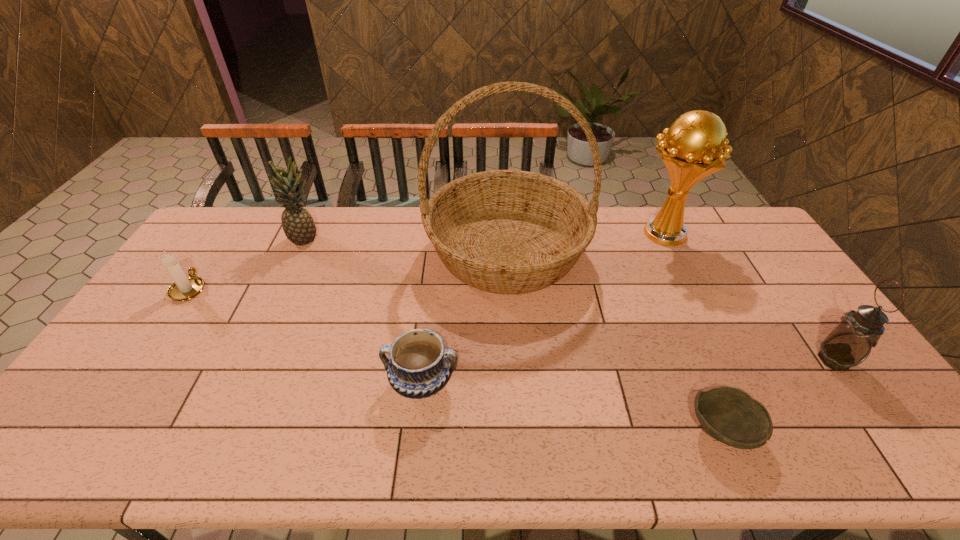
The width and height of the screenshot is (960, 540). What are the coordinates of `vacant area that lies between the candle holder and the second shortest object` in the screenshot? It's located at point(305,335).

Locate an element on the screen. empty location between the tallest object and the rightmost object is located at coordinates (670, 306).

The height and width of the screenshot is (540, 960). Identify the location of vacant space in between the sixth object from right to left and the basket. (406, 245).

The height and width of the screenshot is (540, 960). Find the location of `empty space between the tallest object and the bowl`. empty space between the tallest object and the bowl is located at coordinates (614, 340).

Identify the location of free space between the rightmost object and the tallest object. (670, 306).

Where is `unoccupied position between the rightmost object and the pottery`? This screenshot has width=960, height=540. unoccupied position between the rightmost object and the pottery is located at coordinates (628, 371).

Where is `free area in between the leftmost object and the rightmost object`? free area in between the leftmost object and the rightmost object is located at coordinates (512, 324).

Locate an element on the screen. The image size is (960, 540). object that can be found as the third closest to the candle holder is located at coordinates (503, 231).

Locate which object ranks second in proximity to the pottery. Please provide its 2D coordinates. Your answer should be formatted as a tuple, i.e. [(x, y)], where the tuple contains the x and y coordinates of a point satisfying the conditions above.

[(730, 415)]

This screenshot has width=960, height=540. Identify the location of vacant point that satisfies the following two spatial constraints: 1. on the handle side of the leftmost object; 2. on the left side of the tallest object. (x=214, y=251).